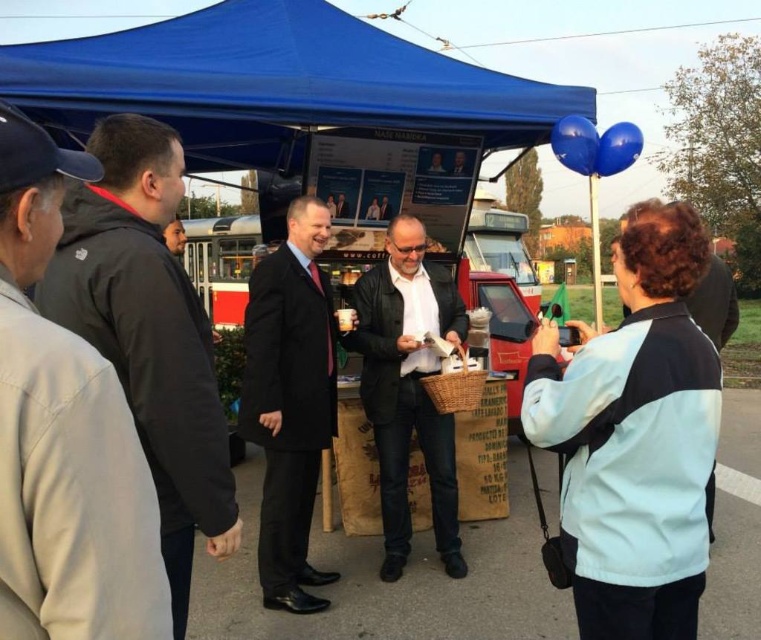
You are standing at point (529, 294) and want to walk to the entrance of the event area. There is a path leading from your current position to the entrance. However, there is an obstacle at point (258, 49). Can you safely walk around the obstacle to reach the entrance without getting too close to it?

Point (258, 49) is in front of point (529, 294). Since the obstacle is in front of your current position, you cannot safely walk around it to reach the entrance without moving past the obstacle first.

You are standing at the center of the image and want to greet the person wearing the dark gray jacket at left. In which direction should you move to reach them?

You should move to the left to reach the dark gray jacket at left, as their position is at point (148, 333) which is to the left side of the image.

You are organizing a photo shoot and need to place two models in the scene. The first model is wearing a dark gray jacket at left, and the second is in a black matte suit at center. To ensure they are spaced appropriately, which model should you position farther to the left to maintain the original scene layout?

The dark gray jacket at left should be positioned farther to the left since it is already located on the left side of the scene, while the black matte suit at center is positioned at the center. This maintains their original positions as described in the scene.